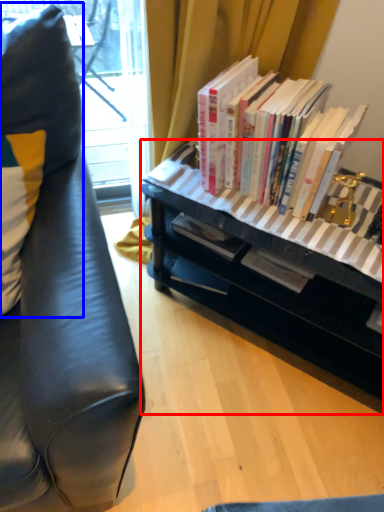
Question: Which of the following is the closest to the observer, desk (highlighted by a red box) or pillow (highlighted by a blue box)?

Choices:
 (A) desk
 (B) pillow

Answer: (B)